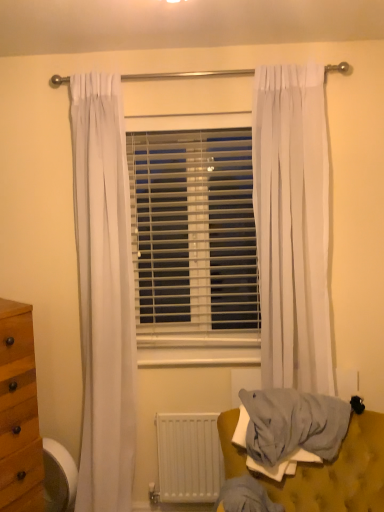
Question: Can light gray fabric at lower right be found inside white plastic blinds at center?

Choices:
 (A) no
 (B) yes

Answer: (A)

Question: Is white plastic blinds at center behind light gray fabric at lower right?

Choices:
 (A) yes
 (B) no

Answer: (A)

Question: From a real-world perspective, is white plastic blinds at center positioned under light gray fabric at lower right based on gravity?

Choices:
 (A) yes
 (B) no

Answer: (B)

Question: Is white plastic blinds at center outside light gray fabric at lower right?

Choices:
 (A) no
 (B) yes

Answer: (B)

Question: Is white plastic blinds at center beside light gray fabric at lower right?

Choices:
 (A) no
 (B) yes

Answer: (A)

Question: Based on their sizes in the image, would you say white sheer curtain at right is bigger or smaller than white plastic blinds at center?

Choices:
 (A) small
 (B) big

Answer: (B)

Question: In terms of width, does white sheer curtain at right look wider or thinner when compared to white plastic blinds at center?

Choices:
 (A) thin
 (B) wide

Answer: (B)

Question: Is point (311, 336) closer or farther from the camera than point (129, 166)?

Choices:
 (A) farther
 (B) closer

Answer: (B)

Question: From the image's perspective, is white sheer curtain at right located above or below white plastic blinds at center?

Choices:
 (A) below
 (B) above

Answer: (B)

Question: Would you say light gray fabric at lower right is to the left or to the right of wooden swivel chair at lower left in the picture?

Choices:
 (A) left
 (B) right

Answer: (B)

Question: Based on their sizes in the image, would you say light gray fabric at lower right is bigger or smaller than wooden swivel chair at lower left?

Choices:
 (A) big
 (B) small

Answer: (A)

Question: Relative to wooden swivel chair at lower left, is light gray fabric at lower right in front or behind?

Choices:
 (A) front
 (B) behind

Answer: (A)

Question: Is light gray fabric at lower right situated inside wooden swivel chair at lower left or outside?

Choices:
 (A) outside
 (B) inside

Answer: (A)

Question: From a real-world perspective, relative to wooden swivel chair at lower left, is white matte radiator at lower center vertically above or below?

Choices:
 (A) above
 (B) below

Answer: (A)

Question: In the image, is white matte radiator at lower center on the left side or the right side of wooden swivel chair at lower left?

Choices:
 (A) left
 (B) right

Answer: (B)